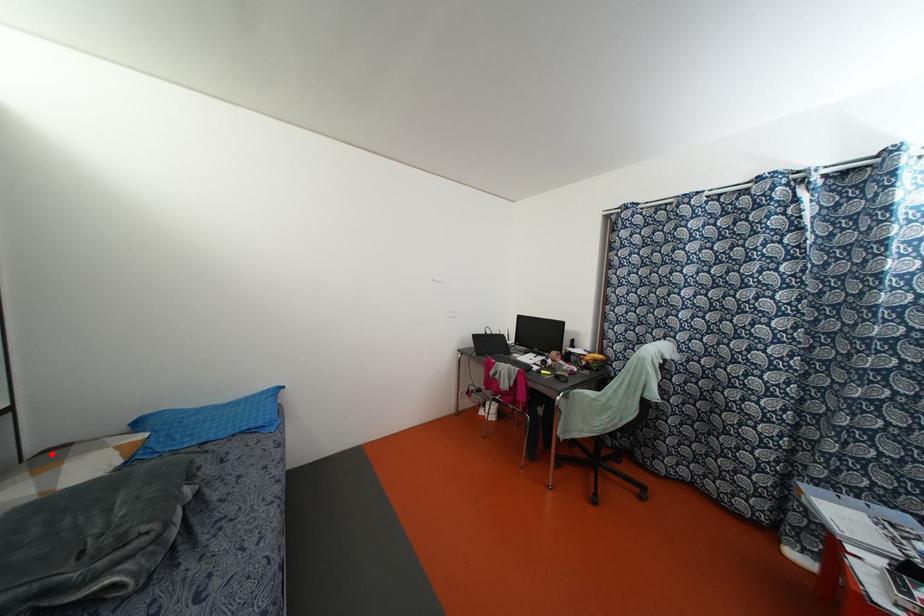
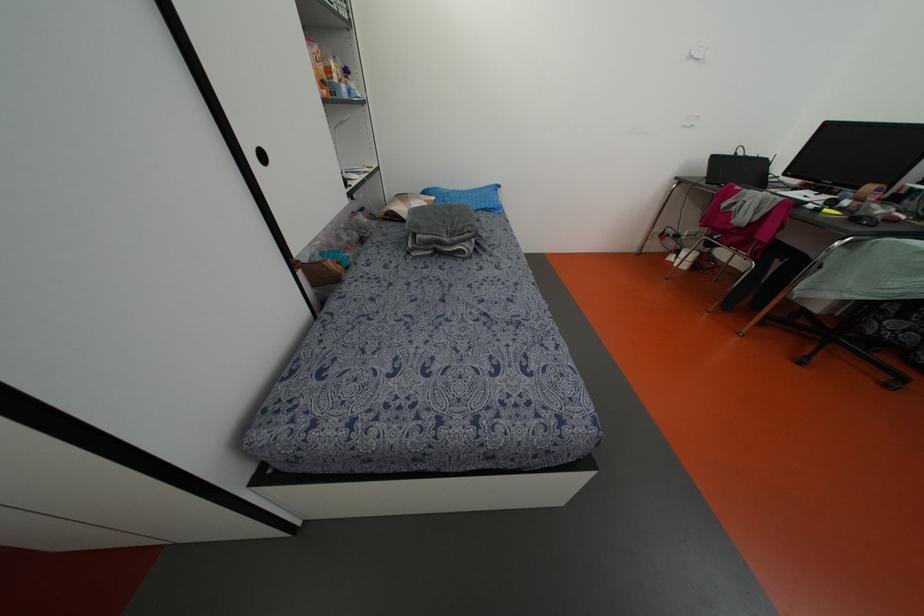
Find the pixel in the second image that matches the highlighted location in the first image.

(402, 197)